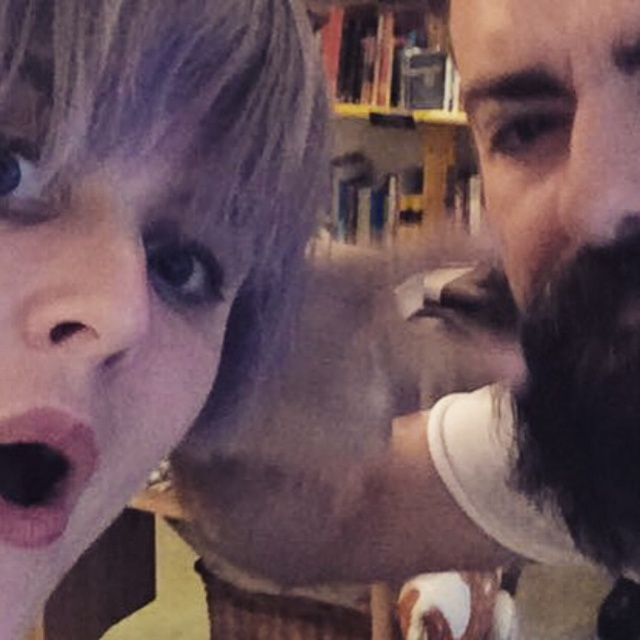
Question: Does dark brown beard at right come in front of pink matte lips at center?

Choices:
 (A) no
 (B) yes

Answer: (A)

Question: Which of the following is the farthest from the observer?

Choices:
 (A) pink matte lips at center
 (B) black fuzzy beard at right
 (C) dark brown beard at right

Answer: (B)

Question: Among these objects, which one is nearest to the camera?

Choices:
 (A) black fuzzy beard at right
 (B) smooth skin face at center
 (C) pink matte lips at center
 (D) bearded man at center

Answer: (B)

Question: Is bearded man at center below pink matte lips at center?

Choices:
 (A) no
 (B) yes

Answer: (A)

Question: Does black fuzzy beard at right have a larger size compared to wooden bookshelf at upper center?

Choices:
 (A) yes
 (B) no

Answer: (B)

Question: Which point is farther to the camera?

Choices:
 (A) black fuzzy beard at right
 (B) dark brown beard at right
 (C) bearded man at center

Answer: (A)